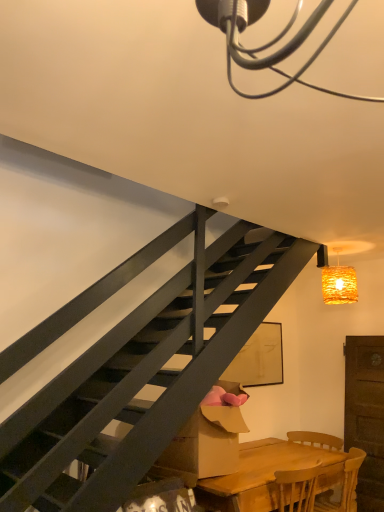
Image resolution: width=384 pixels, height=512 pixels. I want to click on wooden chair at lower right, so click(316, 440).

What do you see at coordinates (337, 280) in the screenshot?
I see `woven wicker lampshade at upper right` at bounding box center [337, 280].

You are a GUI agent. You are given a task and a screenshot of the screen. Output one action in this format:
    pyautogui.click(x=<x>, y=<y>)
    Task: Click on the wooden chair at lower right
    
    Given the screenshot: What is the action you would take?
    pyautogui.click(x=316, y=440)

Between wooden chair at lower right and wooden table at lower right, which one appears on the left side from the viewer's perspective?

wooden table at lower right is more to the left.

From the image's perspective, is wooden chair at lower right above wooden table at lower right?

Indeed, from the image's perspective, wooden chair at lower right is shown above wooden table at lower right.

From a real-world perspective, is wooden chair at lower right above or below wooden table at lower right?

Clearly, from a real-world perspective, wooden chair at lower right is above wooden table at lower right.

Image resolution: width=384 pixels, height=512 pixels. What are the coordinates of `table in front of the wooden chair at lower right` in the screenshot? It's located at (268, 475).

Between woven wicker lampshade at upper right and wooden chair at lower right, which one has larger size?

wooden chair at lower right.

From the picture: Which is more distant, (339,280) or (301,437)?

The point (301,437) is farther from the camera.

From the image's perspective, which one is positioned lower, woven wicker lampshade at upper right or wooden chair at lower right?

From the image's view, wooden chair at lower right is below.

Measure the distance from woven wicker lampshade at upper right to wooden chair at lower right.

4.65 feet.

Is woven wicker lampshade at upper right further to the viewer compared to wooden table at lower right?

That is True.

Could you tell me if woven wicker lampshade at upper right is facing wooden table at lower right?

No, woven wicker lampshade at upper right is not facing towards wooden table at lower right.

Is woven wicker lampshade at upper right wider or thinner than wooden table at lower right?

Clearly, woven wicker lampshade at upper right has less width compared to wooden table at lower right.

Between woven wicker lampshade at upper right and wooden table at lower right, which one has larger size?

wooden table at lower right is bigger.

From the image's perspective, who appears lower, wooden table at lower right or cardboard box at lower center?

wooden table at lower right appears lower in the image.

You are a GUI agent. You are given a task and a screenshot of the screen. Output one action in this format:
    pyautogui.click(x=<x>, y=<y>)
    Task: Click on the cardboard box on the left of wooden table at lower right
    The image size is (384, 512).
    Given the screenshot: What is the action you would take?
    pyautogui.click(x=207, y=442)

How different are the orientations of wooden table at lower right and cardboard box at lower center in degrees?

The facing directions of wooden table at lower right and cardboard box at lower center are 0.659 degrees apart.

Based on their sizes in the image, would you say wooden chair at lower right is bigger or smaller than cardboard box at lower center?

In the image, wooden chair at lower right appears to be smaller than cardboard box at lower center.

Considering the positions of point (324, 436) and point (179, 466), is point (324, 436) closer or farther from the camera than point (179, 466)?

Point (324, 436).

Would you consider wooden chair at lower right to be distant from cardboard box at lower center?

wooden chair at lower right is positioned a significant distance from cardboard box at lower center.

At what (x,y) coordinates should I click in order to perform the action: click on chair that appears below the cardboard box at lower center (from the image's perspective). Please return your answer as a coordinate pair (x, y). Looking at the image, I should click on (316, 440).

Is wooden table at lower right far from wooden chair at lower right?

No, wooden table at lower right is not far from wooden chair at lower right.

Where is `chair located above the wooden table at lower right (from the image's perspective)`? The width and height of the screenshot is (384, 512). chair located above the wooden table at lower right (from the image's perspective) is located at coordinates tap(316, 440).

Which object is more forward, wooden table at lower right or wooden chair at lower right?

wooden table at lower right is closer to the camera.

From the image's perspective, is cardboard box at lower center on top of wooden table at lower right?

Correct, cardboard box at lower center appears higher than wooden table at lower right in the image.

Which object is further away from the camera taking this photo, cardboard box at lower center or wooden table at lower right?

cardboard box at lower center is further away from the camera.

You are a GUI agent. You are given a task and a screenshot of the screen. Output one action in this format:
    pyautogui.click(x=<x>, y=<y>)
    Task: Click on the chair above the wooden table at lower right (from a real-world perspective)
    
    Given the screenshot: What is the action you would take?
    point(316,440)

The width and height of the screenshot is (384, 512). Find the location of `lamp located on the right of wooden chair at lower right`. lamp located on the right of wooden chair at lower right is located at coordinates (337, 280).

Based on their spatial positions, is wooden chair at lower right or cardboard box at lower center further from woven wicker lampshade at upper right?

A: Based on the image, cardboard box at lower center appears to be further to woven wicker lampshade at upper right.

From the image, which object appears to be nearer to cardboard box at lower center, woven wicker lampshade at upper right or wooden table at lower right?

wooden table at lower right lies closer to cardboard box at lower center than the other object.

Estimate the real-world distances between objects in this image. Which object is further from cardboard box at lower center, wooden table at lower right or woven wicker lampshade at upper right?

woven wicker lampshade at upper right is positioned further to the anchor cardboard box at lower center.

From the image, which object appears to be farther from wooden table at lower right, cardboard box at lower center or wooden chair at lower right?

wooden chair at lower right is positioned further to the anchor wooden table at lower right.

Considering their positions, is wooden chair at lower right positioned further to cardboard box at lower center than wooden table at lower right?

wooden chair at lower right is positioned further to the anchor cardboard box at lower center.

When comparing their distances from woven wicker lampshade at upper right, does wooden chair at lower right or wooden table at lower right seem further?

wooden table at lower right lies further to woven wicker lampshade at upper right than the other object.

From the image, which object appears to be nearer to cardboard box at lower center, wooden chair at lower right or woven wicker lampshade at upper right?

The object closer to cardboard box at lower center is wooden chair at lower right.

When comparing their distances from wooden table at lower right, does woven wicker lampshade at upper right or wooden chair at lower right seem closer?

Among the two, wooden chair at lower right is located nearer to wooden table at lower right.

Where is `chair between woven wicker lampshade at upper right and wooden table at lower right in the vertical direction`? chair between woven wicker lampshade at upper right and wooden table at lower right in the vertical direction is located at coordinates (316, 440).

Where is `cardboard box between woven wicker lampshade at upper right and wooden chair at lower right vertically`? The height and width of the screenshot is (512, 384). cardboard box between woven wicker lampshade at upper right and wooden chair at lower right vertically is located at coordinates (207, 442).

You are a GUI agent. You are given a task and a screenshot of the screen. Output one action in this format:
    pyautogui.click(x=<x>, y=<y>)
    Task: Click on the table between cardboard box at lower center and wooden chair at lower right from left to right
    The image size is (384, 512).
    Given the screenshot: What is the action you would take?
    pyautogui.click(x=268, y=475)

At what (x,y) coordinates should I click in order to perform the action: click on cardboard box between woven wicker lampshade at upper right and wooden table at lower right in the up-down direction. Please return your answer as a coordinate pair (x, y). The image size is (384, 512). Looking at the image, I should click on (207, 442).